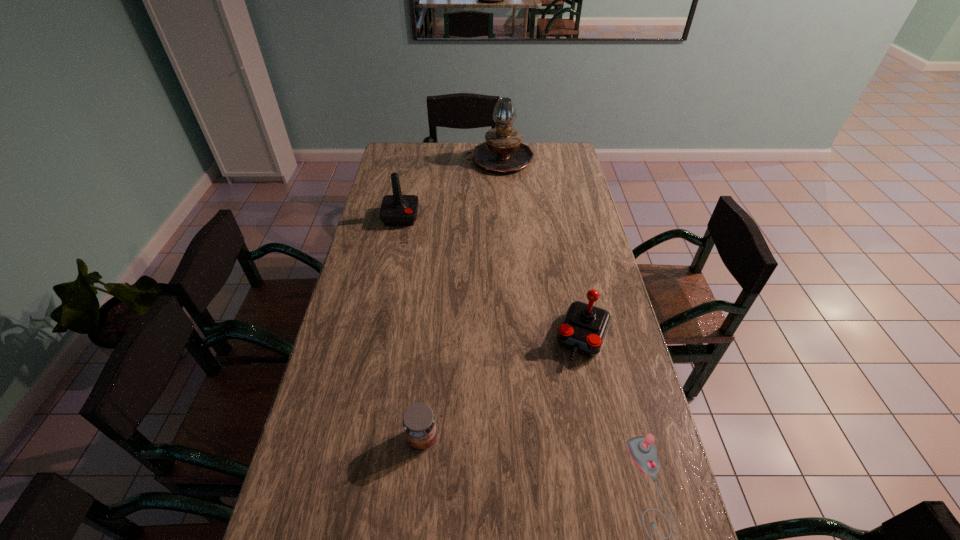
Identify the location of free space located 0.110m on the back of the jam. This screenshot has height=540, width=960. (427, 386).

You are a GUI agent. You are given a task and a screenshot of the screen. Output one action in this format:
    pyautogui.click(x=<x>, y=<y>)
    Task: Click on the object situated at the far edge
    
    Given the screenshot: What is the action you would take?
    pyautogui.click(x=502, y=152)

This screenshot has height=540, width=960. In order to click on object that is positioned at the left edge in this screenshot , I will do `click(396, 210)`.

You are a GUI agent. You are given a task and a screenshot of the screen. Output one action in this format:
    pyautogui.click(x=<x>, y=<y>)
    Task: Click on the object positioned at the right edge
    
    Given the screenshot: What is the action you would take?
    pyautogui.click(x=584, y=327)

Identify the location of free region at the far edge. (452, 152).

This screenshot has width=960, height=540. In the image, there is a desktop. Identify the location of vacant region at the left edge. (375, 228).

The height and width of the screenshot is (540, 960). I want to click on vacant space at the right edge of the desktop, so [x=620, y=407].

Locate an element on the screen. The width and height of the screenshot is (960, 540). vacant space at the far right corner is located at coordinates (573, 157).

Identify the location of free spot between the fourth nearest object and the fourth object from right to left. The image size is (960, 540). (412, 327).

In order to click on vacant space that is in between the fourth object from right to left and the leftmost object in this screenshot , I will do `click(412, 327)`.